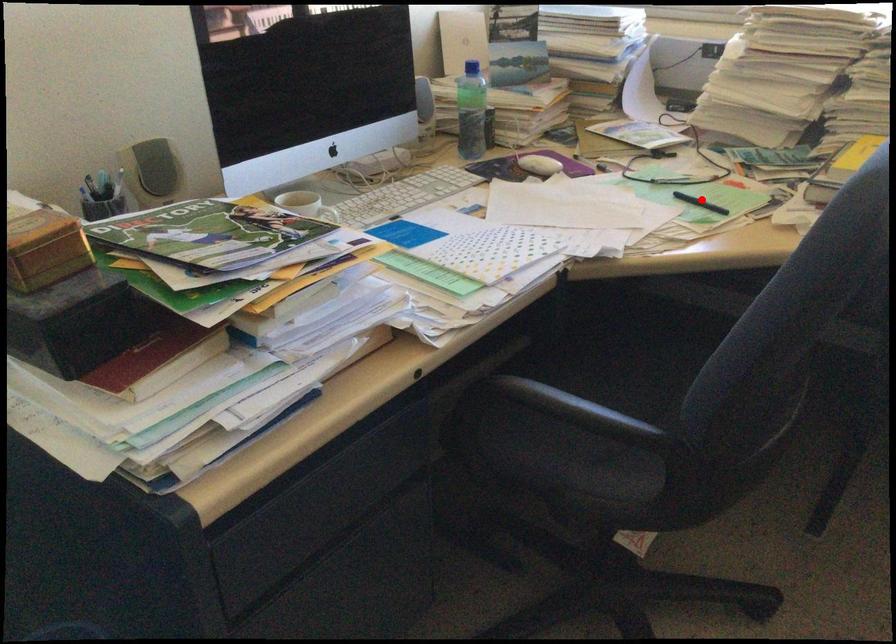
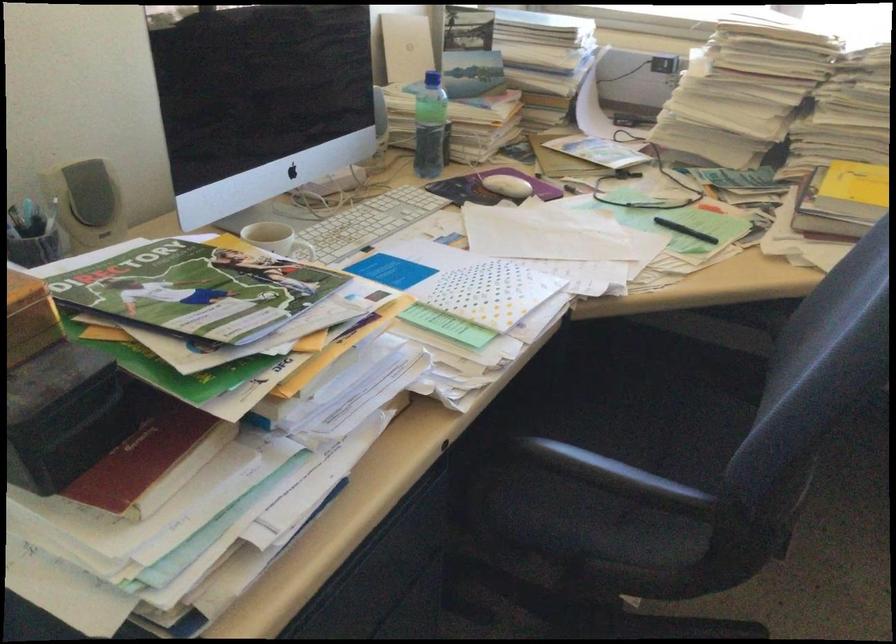
In the second image, find the point that corresponds to the highlighted location in the first image.

(684, 230)